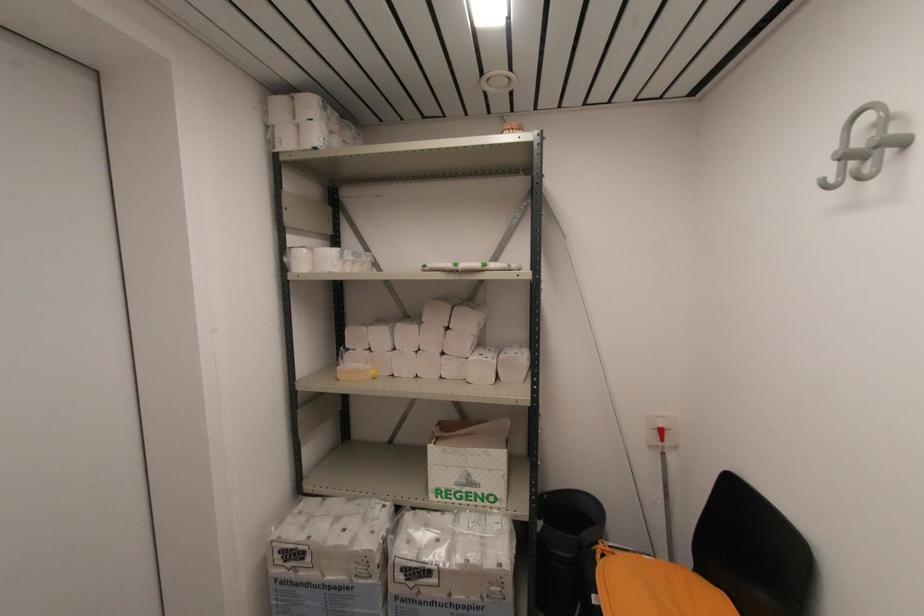
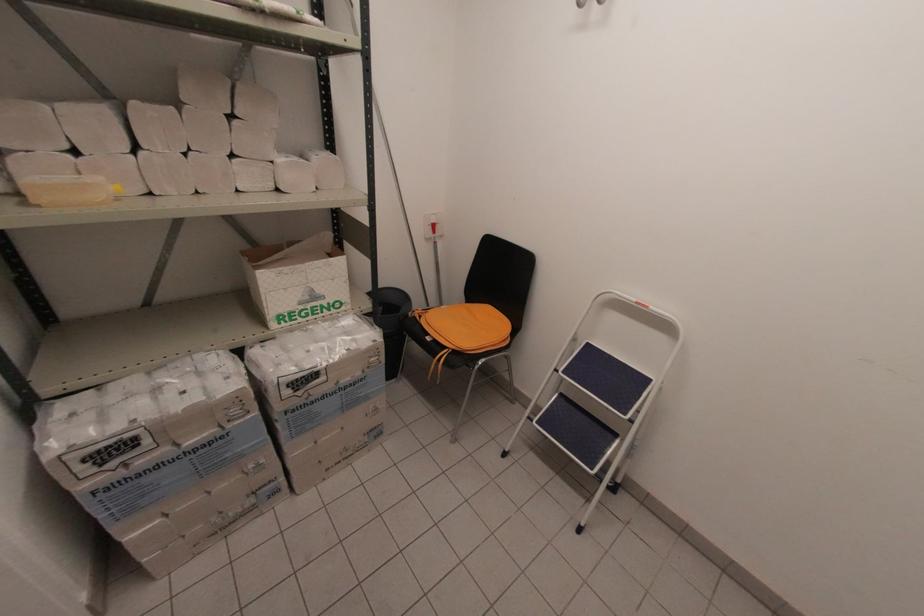
In the second image, find the point that corresponds to point (465, 480) in the first image.

(309, 298)